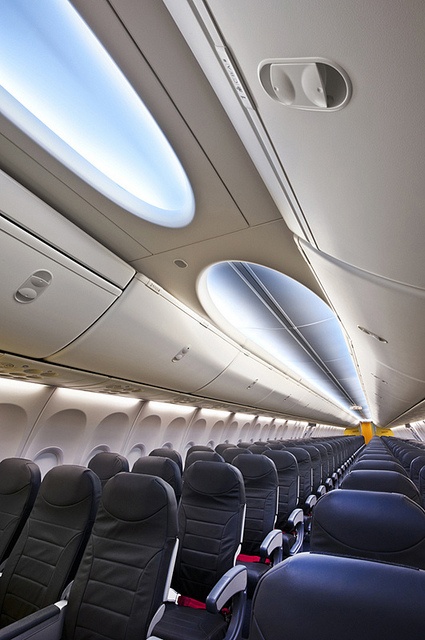
Image resolution: width=425 pixels, height=640 pixels. I want to click on door latches, so click(x=378, y=338), click(x=381, y=379), click(x=176, y=356), click(x=28, y=289), click(x=249, y=386), click(x=286, y=397), click(x=304, y=406), click(x=378, y=397).